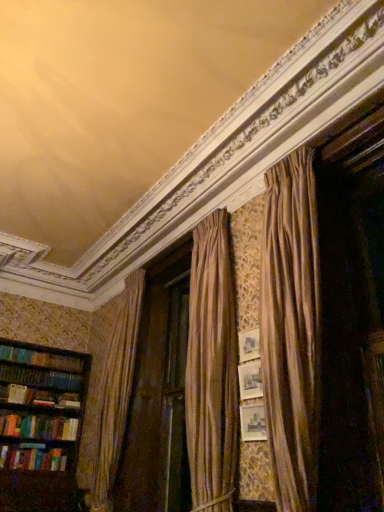
This screenshot has width=384, height=512. Find the location of `wooden bookshelf at left`. wooden bookshelf at left is located at coordinates (40, 426).

Image resolution: width=384 pixels, height=512 pixels. What do you see at coordinates (40, 426) in the screenshot? I see `wooden bookshelf at left` at bounding box center [40, 426].

The image size is (384, 512). Identify the location of multicolored hardcover books at left. (x=32, y=457).

The image size is (384, 512). What do you see at coordinates (32, 457) in the screenshot? I see `multicolored hardcover books at left` at bounding box center [32, 457].

Where is `wooden bookshelf at left`? This screenshot has width=384, height=512. wooden bookshelf at left is located at coordinates (40, 426).

Considering the relative positions of wooden bookshelf at left and multicolored hardcover books at left in the image provided, is wooden bookshelf at left to the left or to the right of multicolored hardcover books at left?

Based on their positions, wooden bookshelf at left is located to the right of multicolored hardcover books at left.

Which object is further away from the camera, wooden bookshelf at left or multicolored hardcover books at left?

Positioned behind is multicolored hardcover books at left.

Is point (50, 395) positioned in front of point (34, 453)?

No, (50, 395) is further to viewer.

From the image's perspective, is wooden bookshelf at left beneath multicolored hardcover books at left?

Incorrect, from the image's perspective, wooden bookshelf at left is higher than multicolored hardcover books at left.

From the picture: From a real-world perspective, is wooden bookshelf at left above or below multicolored hardcover books at left?

wooden bookshelf at left is above multicolored hardcover books at left.

Is wooden bookshelf at left thinner than multicolored hardcover books at left?

Incorrect, the width of wooden bookshelf at left is not less than that of multicolored hardcover books at left.

Does wooden bookshelf at left have a greater height compared to multicolored hardcover books at left?

Yes.

Who is bigger, wooden bookshelf at left or multicolored hardcover books at left?

wooden bookshelf at left is bigger.

Can we say wooden bookshelf at left lies outside multicolored hardcover books at left?

Yes, wooden bookshelf at left is not within multicolored hardcover books at left.

Is wooden bookshelf at left positioned far away from multicolored hardcover books at left?

They are positioned close to each other.

Is wooden bookshelf at left positioned with its back to multicolored hardcover books at left?

Yes, multicolored hardcover books at left is at the back of wooden bookshelf at left.

How many degrees apart are the facing directions of wooden bookshelf at left and multicolored hardcover books at left?

The angular difference between wooden bookshelf at left and multicolored hardcover books at left is 0.543 degrees.

Locate an element on the screen. book located underneath the wooden bookshelf at left (from a real-world perspective) is located at coordinates coord(32,457).

In the image, is multicolored hardcover books at left on the left side or the right side of wooden bookshelf at left?

From the image, it's evident that multicolored hardcover books at left is to the left of wooden bookshelf at left.

Between multicolored hardcover books at left and wooden bookshelf at left, which one is positioned behind?

multicolored hardcover books at left is behind.

Is point (56, 454) positioned before point (50, 484)?

No, it is not.

From the image's perspective, is multicolored hardcover books at left located above or below wooden bookshelf at left?

multicolored hardcover books at left is situated lower than wooden bookshelf at left in the image.

Based on the photo, from a real-world perspective, is multicolored hardcover books at left physically located above or below wooden bookshelf at left?

multicolored hardcover books at left is below wooden bookshelf at left.

Which of these two, multicolored hardcover books at left or wooden bookshelf at left, is thinner?

multicolored hardcover books at left is thinner.

Considering the sizes of objects multicolored hardcover books at left and wooden bookshelf at left in the image provided, who is taller, multicolored hardcover books at left or wooden bookshelf at left?

wooden bookshelf at left is taller.

Considering the sizes of objects multicolored hardcover books at left and wooden bookshelf at left in the image provided, who is smaller, multicolored hardcover books at left or wooden bookshelf at left?

multicolored hardcover books at left.

Is multicolored hardcover books at left surrounding wooden bookshelf at left?

No.

Would you say multicolored hardcover books at left is a long distance from wooden bookshelf at left?

multicolored hardcover books at left is near wooden bookshelf at left, not far away.

Is multicolored hardcover books at left facing away from wooden bookshelf at left?

Yes.

Measure the distance from multicolored hardcover books at left to wooden bookshelf at left.

multicolored hardcover books at left is 14.09 inches away from wooden bookshelf at left.

Where is `book that appears behind the wooden bookshelf at left`? Image resolution: width=384 pixels, height=512 pixels. book that appears behind the wooden bookshelf at left is located at coordinates (32, 457).

Where is `bookcase above the multicolored hardcover books at left (from a real-world perspective)`? bookcase above the multicolored hardcover books at left (from a real-world perspective) is located at coordinates (40, 426).

The height and width of the screenshot is (512, 384). What are the coordinates of `book beneath the wooden bookshelf at left (from a real-world perspective)` in the screenshot? It's located at (32, 457).